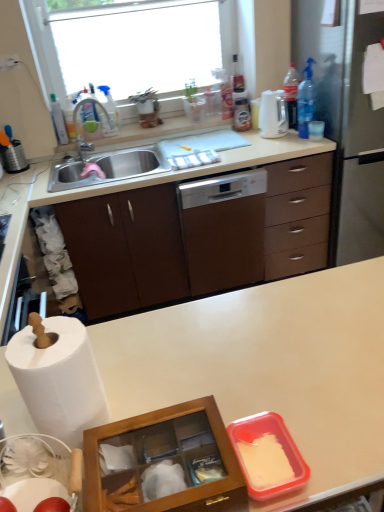
Question: Is blue translucent bottle at upper right, which ranks as the 1th bottle in right-to-left order, oriented away from white glossy dishwasher at center?

Choices:
 (A) yes
 (B) no

Answer: (B)

Question: From a real-world perspective, is blue translucent bottle at upper right, which ranks as the 1th bottle in right-to-left order, on white glossy dishwasher at center?

Choices:
 (A) yes
 (B) no

Answer: (A)

Question: From a real-world perspective, is blue translucent bottle at upper right, which appears as the fourth bottle when viewed from the left, located beneath white glossy dishwasher at center?

Choices:
 (A) yes
 (B) no

Answer: (B)

Question: From the image's perspective, is blue translucent bottle at upper right, which ranks as the 1th bottle in right-to-left order, below white glossy dishwasher at center?

Choices:
 (A) yes
 (B) no

Answer: (B)

Question: Is blue translucent bottle at upper right, which appears as the fourth bottle when viewed from the left, further to the viewer compared to white glossy dishwasher at center?

Choices:
 (A) no
 (B) yes

Answer: (B)

Question: Does blue translucent bottle at upper right, which ranks as the 1th bottle in right-to-left order, appear on the right side of white glossy dishwasher at center?

Choices:
 (A) yes
 (B) no

Answer: (A)

Question: From a real-world perspective, is white glossy electric kettle at upper right on top of transparent glass window at upper center?

Choices:
 (A) no
 (B) yes

Answer: (A)

Question: Could you tell me if white glossy electric kettle at upper right is turned towards transparent glass window at upper center?

Choices:
 (A) no
 (B) yes

Answer: (A)

Question: Can you confirm if white glossy electric kettle at upper right is thinner than transparent glass window at upper center?

Choices:
 (A) yes
 (B) no

Answer: (A)

Question: Is white glossy electric kettle at upper right next to transparent glass window at upper center and touching it?

Choices:
 (A) yes
 (B) no

Answer: (B)

Question: Considering the relative positions of white glossy electric kettle at upper right and transparent glass window at upper center in the image provided, is white glossy electric kettle at upper right to the right of transparent glass window at upper center from the viewer's perspective?

Choices:
 (A) yes
 (B) no

Answer: (A)

Question: Is white glossy electric kettle at upper right oriented away from transparent glass window at upper center?

Choices:
 (A) no
 (B) yes

Answer: (A)

Question: From a real-world perspective, is transparent glass window at upper center below white matte countertop at center?

Choices:
 (A) yes
 (B) no

Answer: (B)